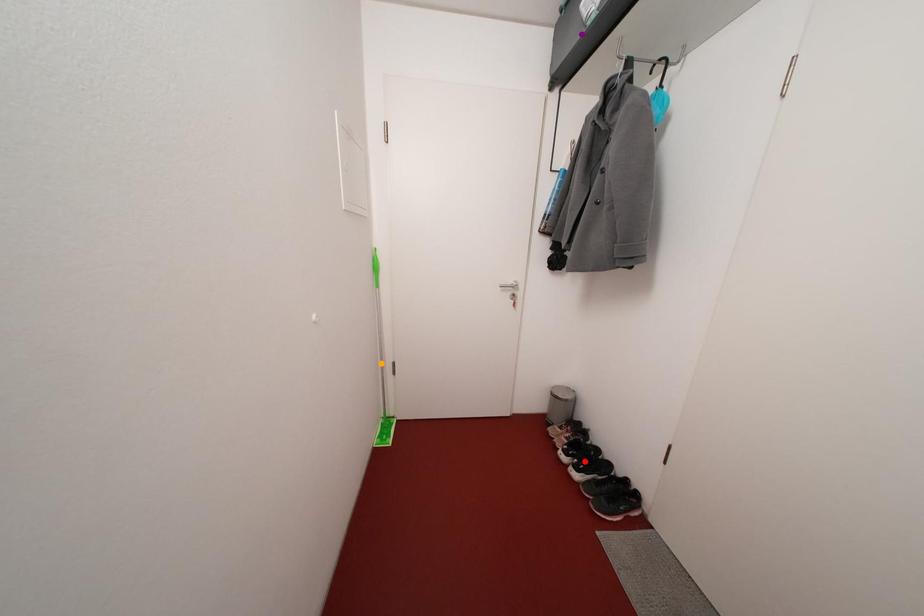
Based on the photo, order these from nearest to farthest:
A) red point
B) purple point
C) orange point

purple point → red point → orange point